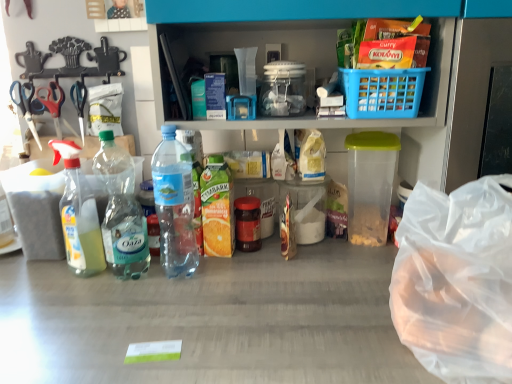
Question: From the image's perspective, is clear plastic spray bottle at left, the 1th bottle in the left-to-right sequence, located above or below red plastic scissors at left, which is the 2th scissors from right to left?

Choices:
 (A) above
 (B) below

Answer: (B)

Question: In terms of width, does clear plastic spray bottle at left, the 1th bottle in the left-to-right sequence, look wider or thinner when compared to red plastic scissors at left, which is the 2th scissors from right to left?

Choices:
 (A) wide
 (B) thin

Answer: (A)

Question: Estimate the real-world distances between objects in this image. Which object is farther from the metallic scissors at left, the 3th scissors in the right-to-left sequence?

Choices:
 (A) blue plastic basket at upper right
 (B) transparent plastic bag at lower right
 (C) silver metallic scissors at left, positioned as the first scissors in right-to-left order
 (D) clear plastic bottle at left, which is the second bottle from right to left
 (E) clear plastic spray bottle at left, acting as the 3th bottle starting from the right

Answer: (B)

Question: Which object is positioned closest to the translucent plastic bottle at center, the first bottle viewed from the right?

Choices:
 (A) clear plastic bottle at left, positioned as the second bottle in left-to-right order
 (B) silver metallic scissors at left, the 3th scissors when ordered from left to right
 (C) clear plastic spray bottle at left, the 1th bottle in the left-to-right sequence
 (D) blue plastic basket at upper right
 (E) metallic scissors at left, the 3th scissors in the right-to-left sequence

Answer: (A)